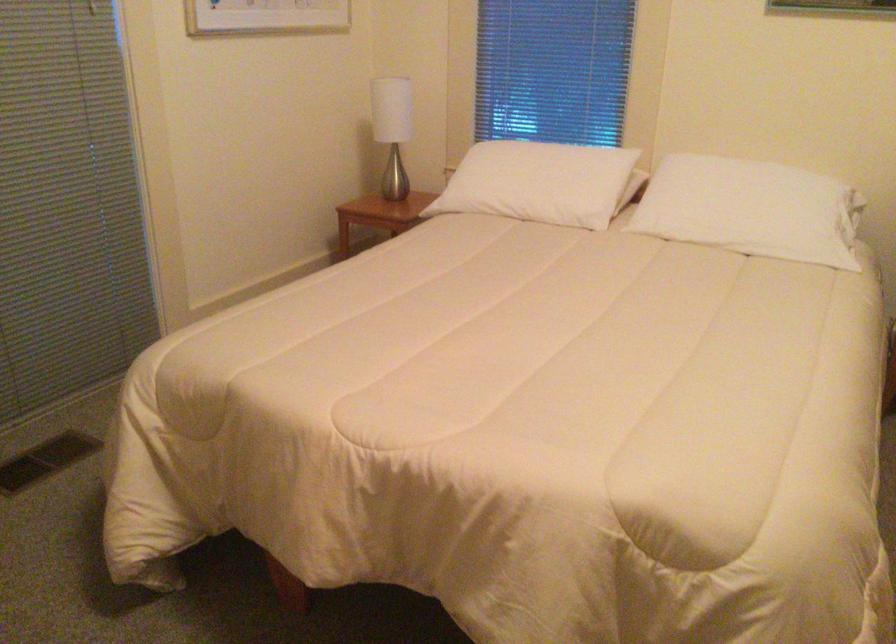
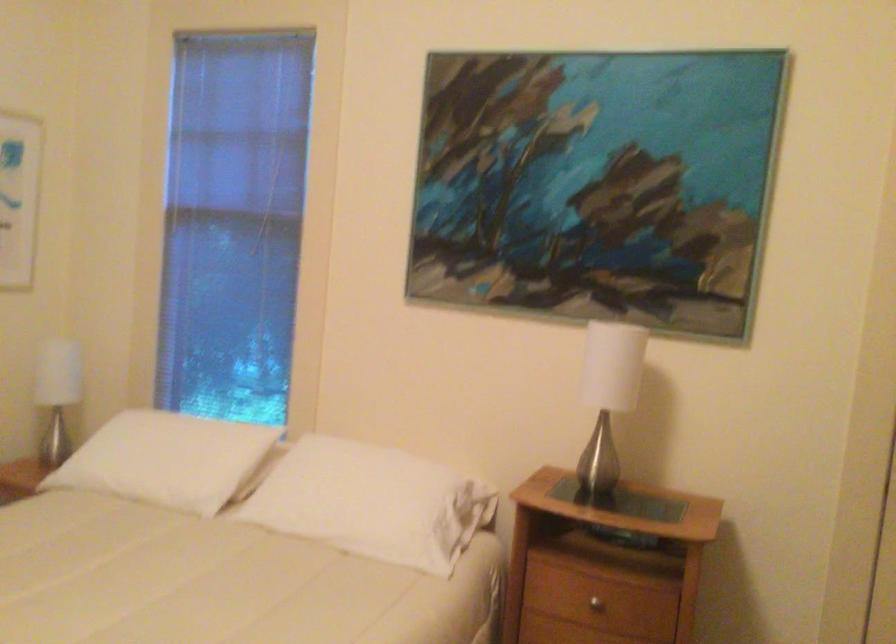
Question: Based on the continuous images, in which direction is the camera rotating? Reply with the corresponding letter.

Choices:
 (A) Left
 (B) Right
 (C) Up
 (D) Down

Answer: (C)